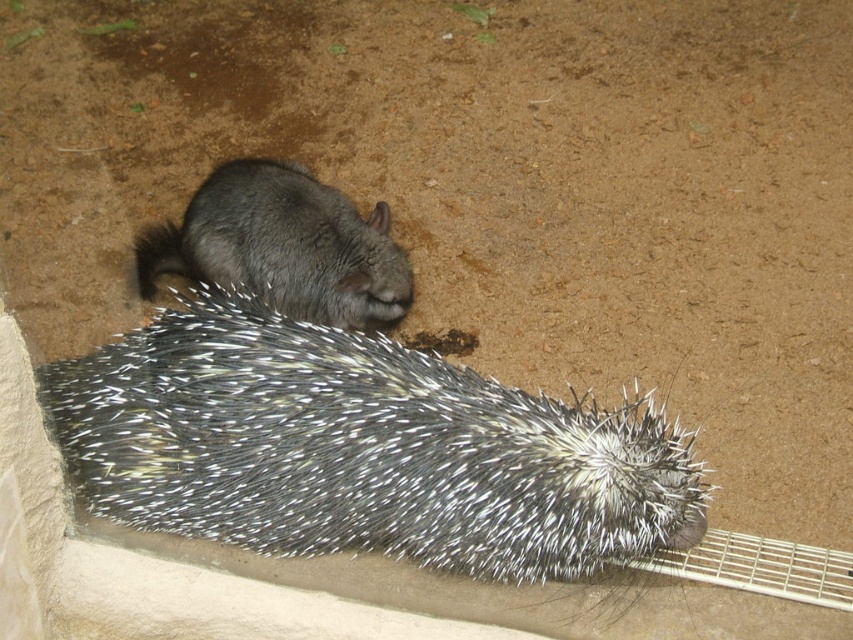
You are a photographer trying to capture both the spiky fur hedgehog at lower left and the gray furry rodent at center in a single frame. Based on their positions, which animal should you adjust your camera focus to first to ensure both are in focus?

The spiky fur hedgehog at lower left is positioned on the right side of gray furry rodent at center. Since the gray furry rodent at center is further away, you should focus on it first to ensure depth of field captures both animals.